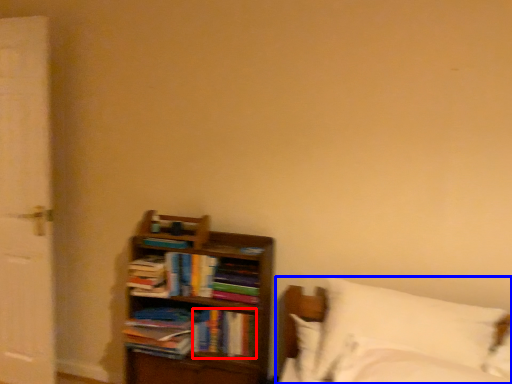
Question: Among these objects, which one is nearest to the camera, book (highlighted by a red box) or bed (highlighted by a blue box)?

Choices:
 (A) book
 (B) bed

Answer: (B)